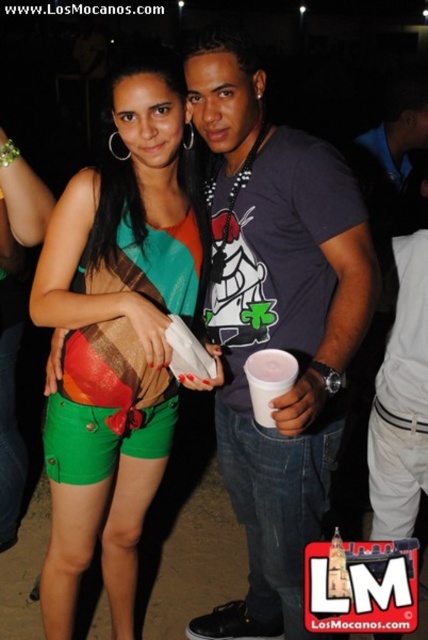
Can you confirm if green cotton shorts at lower left is positioned below white plastic cup at center?

Correct, green cotton shorts at lower left is located below white plastic cup at center.

Does point (73, 529) lie in front of point (288, 371)?

No, (73, 529) is further to viewer.

The height and width of the screenshot is (640, 428). I want to click on green cotton shorts at lower left, so click(x=115, y=336).

Who is taller, dark gray t-shirt at center or white plastic cup at center?

dark gray t-shirt at center is taller.

Is point (288, 305) less distant than point (261, 376)?

That is False.

Is point (333, 160) farther from camera compared to point (269, 426)?

Yes, point (333, 160) is behind point (269, 426).

Identify the location of dark gray t-shirt at center. (275, 323).

Consider the image. Is dark gray t-shirt at center closer to the viewer compared to green cotton shorts at lower left?

Yes, it is in front of green cotton shorts at lower left.

Is point (219, 77) less distant than point (74, 262)?

Yes, point (219, 77) is in front of point (74, 262).

Does point (262, 600) come in front of point (76, 570)?

No.

You are a GUI agent. You are given a task and a screenshot of the screen. Output one action in this format:
    pyautogui.click(x=<x>, y=<y>)
    Task: Click on the dark gray t-shirt at center
    The height and width of the screenshot is (640, 428).
    Given the screenshot: What is the action you would take?
    [275, 323]